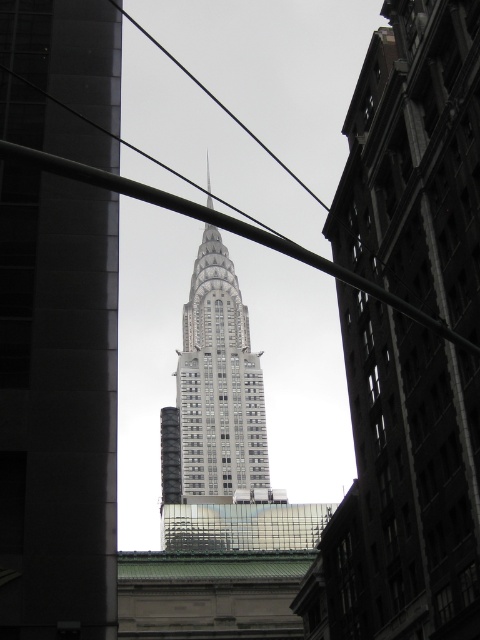
Looking at this image, does silver glass skyscraper at center have a smaller size compared to black wire at upper center?

Indeed, silver glass skyscraper at center has a smaller size compared to black wire at upper center.

Which of these two, silver glass skyscraper at center or black wire at upper center, stands shorter?

Standing shorter between the two is silver glass skyscraper at center.

You are a GUI agent. You are given a task and a screenshot of the screen. Output one action in this format:
    pyautogui.click(x=<x>, y=<y>)
    Task: Click on the silver glass skyscraper at center
    Image resolution: width=480 pixels, height=640 pixels.
    Given the screenshot: What is the action you would take?
    pyautogui.click(x=216, y=388)

Where is `silver glass skyscraper at center`? The height and width of the screenshot is (640, 480). silver glass skyscraper at center is located at coordinates (216, 388).

Does silver glass skyscraper at center have a greater height compared to metallic wire at center?

Yes, silver glass skyscraper at center is taller than metallic wire at center.

Is point (187, 497) positioned in front of point (216, 218)?

That is False.

This screenshot has width=480, height=640. In order to click on silver glass skyscraper at center in this screenshot , I will do `click(216, 388)`.

The image size is (480, 640). Find the location of `silver glass skyscraper at center`. silver glass skyscraper at center is located at coordinates (216, 388).

Which is behind, point (87, 339) or point (216, 212)?

The point (87, 339) is behind.

Which is below, gray glass skyscraper at center or metallic wire at center?

Positioned lower is metallic wire at center.

You are a GUI agent. You are given a task and a screenshot of the screen. Output one action in this format:
    pyautogui.click(x=<x>, y=<y>)
    Task: Click on the gray glass skyscraper at center
    This screenshot has width=480, height=640.
    Given the screenshot: What is the action you would take?
    pyautogui.click(x=57, y=406)